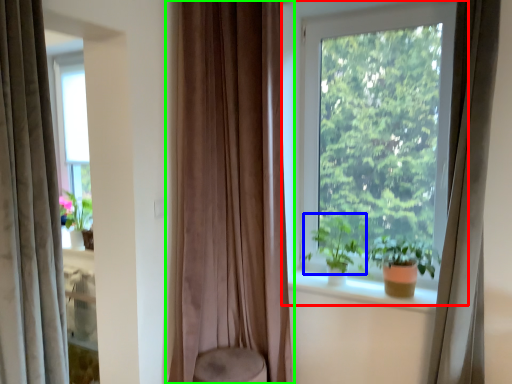
Question: Based on their relative distances, which object is nearer to window (highlighted by a red box)? Choose from vegetation (highlighted by a blue box) and curtain (highlighted by a green box).

Choices:
 (A) vegetation
 (B) curtain

Answer: (A)